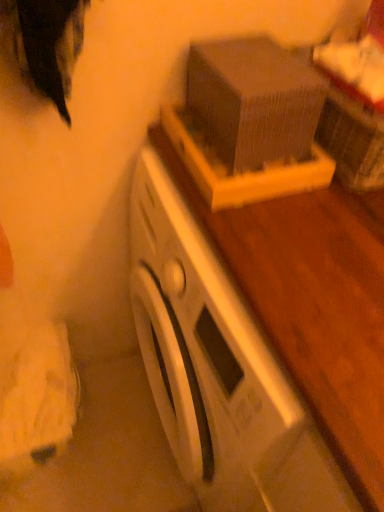
Question: Could you tell me if white matte washing machine at center is facing wooden box at upper center?

Choices:
 (A) yes
 (B) no

Answer: (B)

Question: Is white matte washing machine at center touching wooden box at upper center?

Choices:
 (A) yes
 (B) no

Answer: (B)

Question: Considering the relative sizes of white matte washing machine at center and wooden box at upper center in the image provided, is white matte washing machine at center taller than wooden box at upper center?

Choices:
 (A) yes
 (B) no

Answer: (A)

Question: From the image's perspective, is white matte washing machine at center beneath wooden box at upper center?

Choices:
 (A) yes
 (B) no

Answer: (A)

Question: Considering the relative sizes of white matte washing machine at center and wooden box at upper center in the image provided, is white matte washing machine at center wider than wooden box at upper center?

Choices:
 (A) no
 (B) yes

Answer: (B)

Question: From a real-world perspective, is white matte washing machine at center under wooden box at upper center?

Choices:
 (A) yes
 (B) no

Answer: (A)

Question: Is wooden box at upper center facing away from white matte washing machine at center?

Choices:
 (A) yes
 (B) no

Answer: (B)

Question: Does wooden box at upper center contain white matte washing machine at center?

Choices:
 (A) yes
 (B) no

Answer: (B)

Question: Considering the relative positions of wooden box at upper center and white matte washing machine at center in the image provided, is wooden box at upper center to the right of white matte washing machine at center from the viewer's perspective?

Choices:
 (A) no
 (B) yes

Answer: (A)

Question: Considering the relative sizes of wooden box at upper center and white matte washing machine at center in the image provided, is wooden box at upper center thinner than white matte washing machine at center?

Choices:
 (A) no
 (B) yes

Answer: (B)

Question: From a real-world perspective, does wooden box at upper center stand above white matte washing machine at center?

Choices:
 (A) yes
 (B) no

Answer: (A)

Question: Can you confirm if wooden box at upper center is shorter than white matte washing machine at center?

Choices:
 (A) no
 (B) yes

Answer: (B)

Question: Considering the relative positions of white matte washing machine at center and wooden box at upper center in the image provided, is white matte washing machine at center to the left or to the right of wooden box at upper center?

Choices:
 (A) right
 (B) left

Answer: (A)